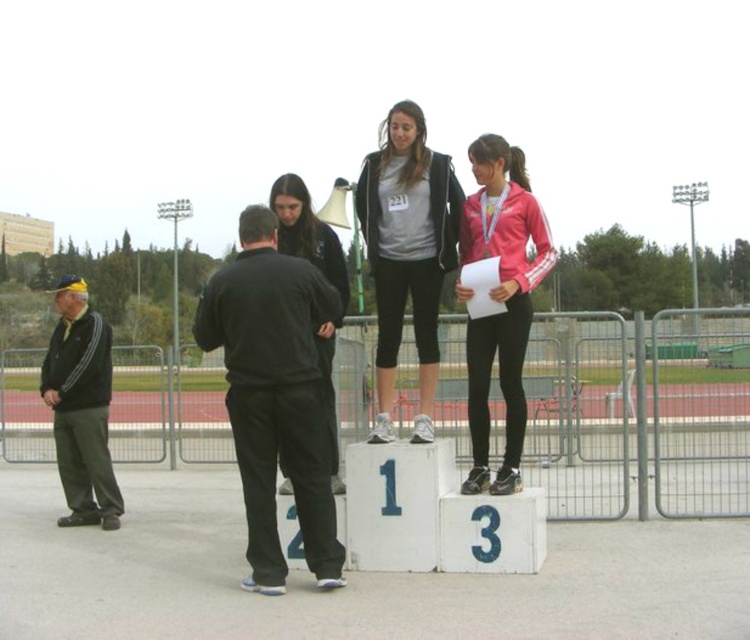
Question: Does black matte pants at center have a smaller size compared to black matte jacket at center?

Choices:
 (A) no
 (B) yes

Answer: (A)

Question: Which point is closer to the camera taking this photo?

Choices:
 (A) (514, 273)
 (B) (309, 371)

Answer: (B)

Question: Does pink matte jacket at center appear on the right side of black matte jacket at center?

Choices:
 (A) yes
 (B) no

Answer: (A)

Question: Which point appears closest to the camera in this image?

Choices:
 (A) (390, 326)
 (B) (312, 301)
 (C) (516, 371)
 (D) (62, 403)

Answer: (B)

Question: Does matte gray hoodie at center appear on the left side of pink matte jacket at center?

Choices:
 (A) no
 (B) yes

Answer: (B)

Question: Among these points, which one is nearest to the camera?

Choices:
 (A) (322, 452)
 (B) (471, 422)
 (C) (75, 518)

Answer: (A)